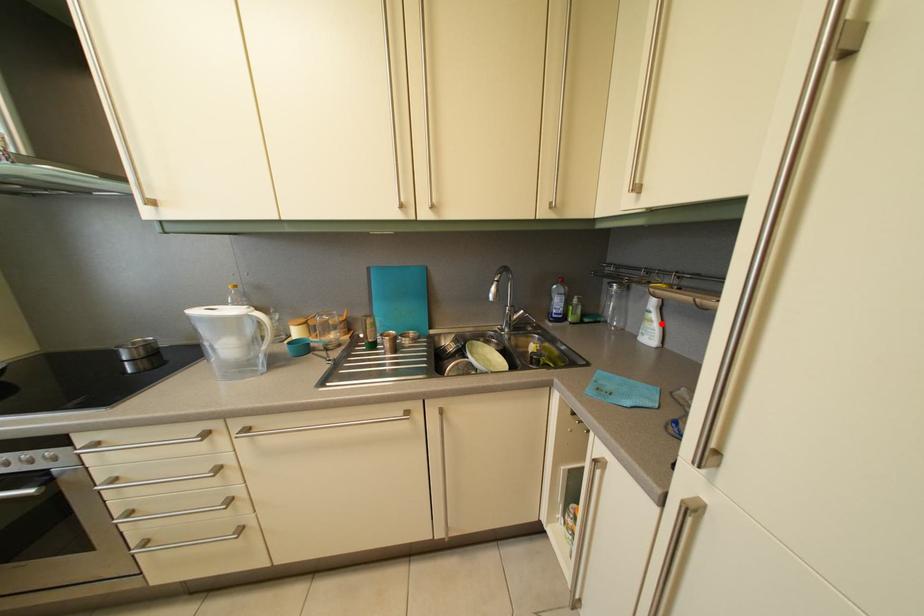
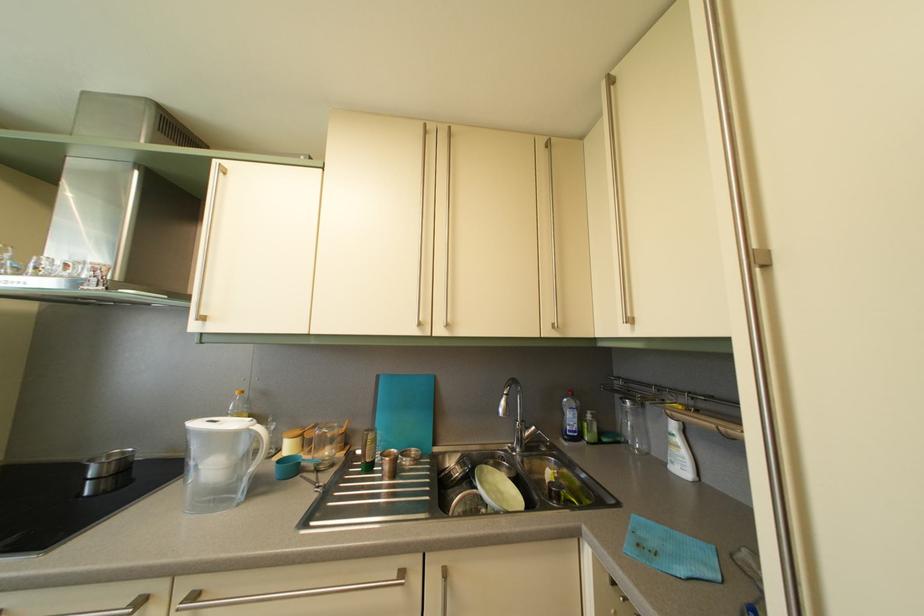
The point at the highlighted location is marked in the first image. Where is the corresponding point in the second image?

(687, 448)